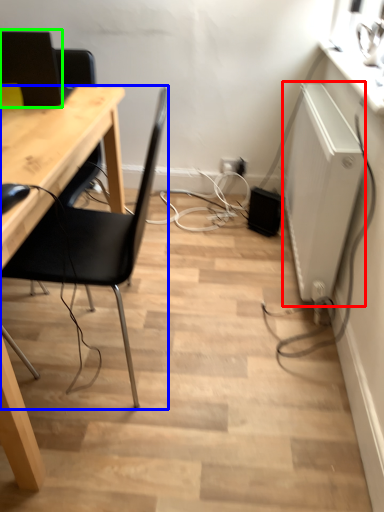
Question: Based on their relative distances, which object is farther from appliance (highlighted by a red box)? Choose from chair (highlighted by a blue box) and computer monitor (highlighted by a green box).

Choices:
 (A) chair
 (B) computer monitor

Answer: (B)